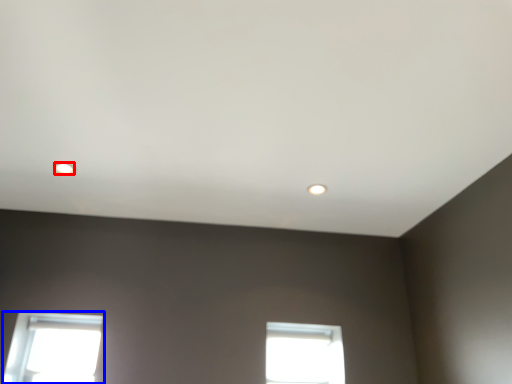
Question: Which of the following is the closest to the observer, lighting (highlighted by a red box) or window (highlighted by a blue box)?

Choices:
 (A) lighting
 (B) window

Answer: (A)